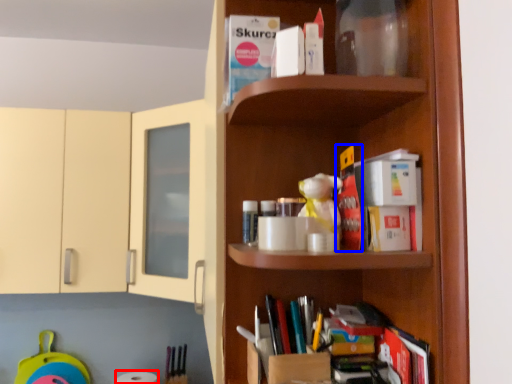
Question: Which of the following is the farthest to the observer, toilet paper (highlighted by a red box) or book (highlighted by a blue box)?

Choices:
 (A) toilet paper
 (B) book

Answer: (A)